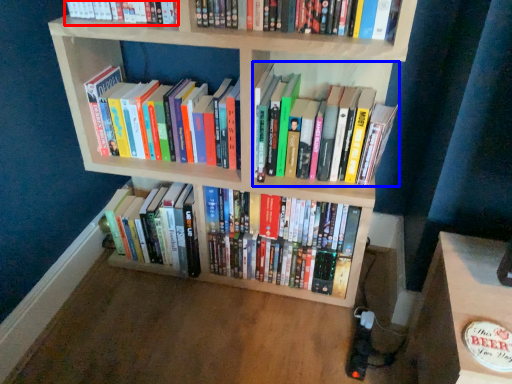
Question: Which object appears closest to the camera in this image, book (highlighted by a red box) or book (highlighted by a blue box)?

Choices:
 (A) book
 (B) book

Answer: (A)